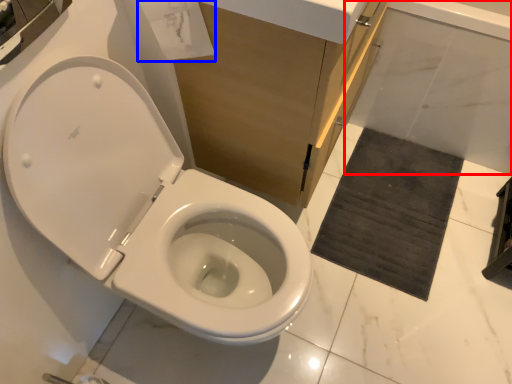
Question: Which object appears closest to the camera in this image, bath (highlighted by a red box) or toilet paper (highlighted by a blue box)?

Choices:
 (A) bath
 (B) toilet paper

Answer: (B)